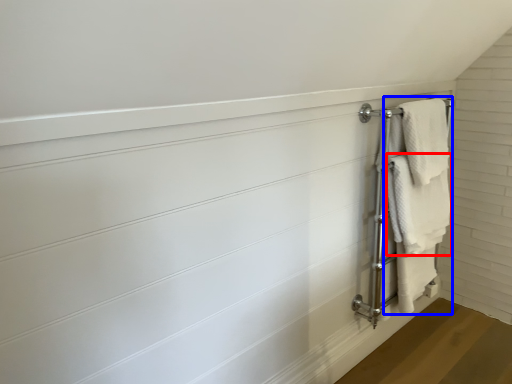
Question: Which point is further to the camera, towel (highlighted by a red box) or bath towel (highlighted by a blue box)?

Choices:
 (A) towel
 (B) bath towel

Answer: (A)